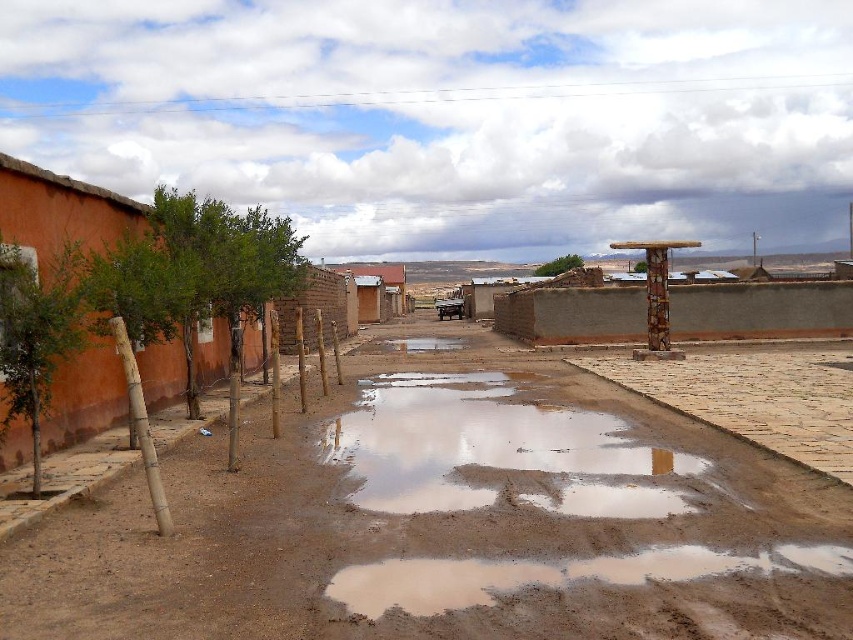
Can you confirm if brown dirt at center is positioned below transparent mud water at center?

Incorrect, brown dirt at center is not positioned below transparent mud water at center.

Measure the distance between brown dirt at center and camera.

They are 15.98 feet apart.

Between point (479, 483) and point (386, 488), which one is positioned behind?

The point (479, 483) is more distant.

This screenshot has width=853, height=640. I want to click on brown dirt at center, so click(447, 522).